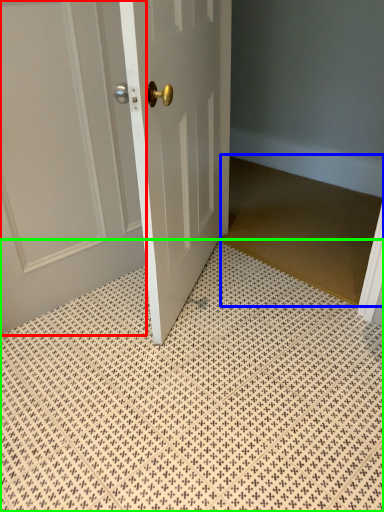
Question: Based on their relative distances, which object is nearer to door (highlighted by a red box)? Choose from doormat (highlighted by a blue box) and bath mat (highlighted by a green box).

Choices:
 (A) doormat
 (B) bath mat

Answer: (B)